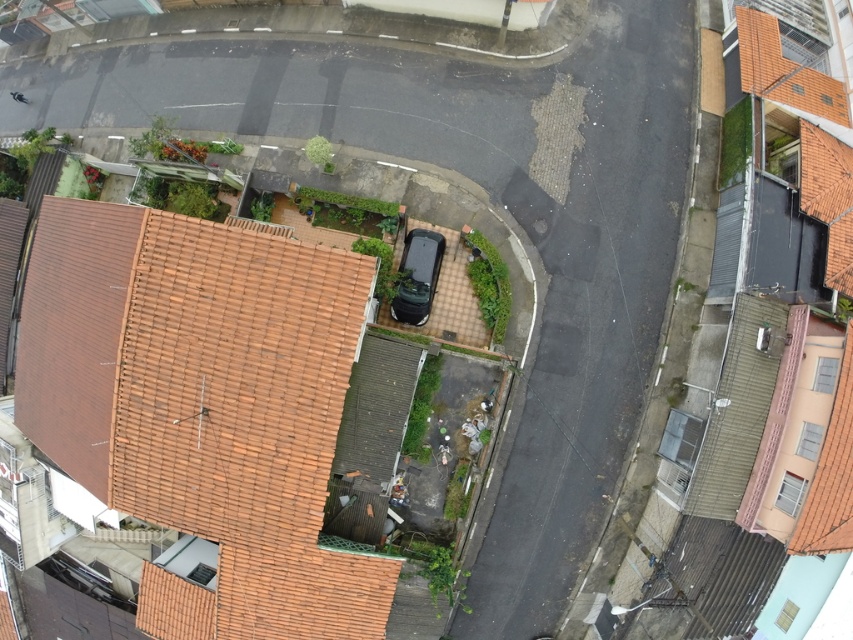
Can you confirm if brown tile roof at lower left is wider than orange tile roof at upper right?

Yes.

Image resolution: width=853 pixels, height=640 pixels. What are the coordinates of `brown tile roof at lower left` in the screenshot? It's located at (189, 365).

Between point (19, 396) and point (780, 92), which one is positioned behind?

Point (780, 92)

Where is `brown tile roof at lower left`? Image resolution: width=853 pixels, height=640 pixels. brown tile roof at lower left is located at coordinates (189, 365).